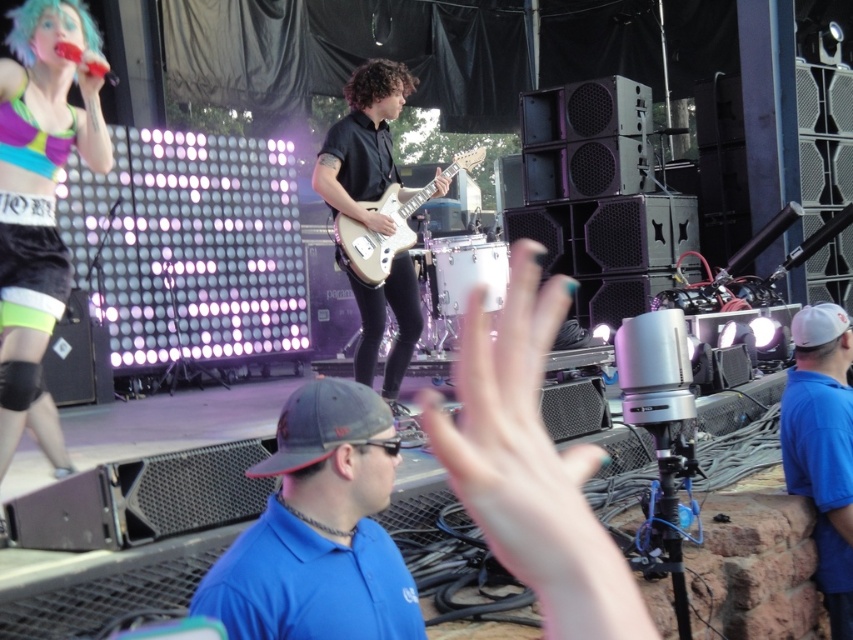
Is blue cotton shirt at right shorter than matte white guitar at center?

Yes, blue cotton shirt at right is shorter than matte white guitar at center.

Is point (821, 448) more distant than point (401, 97)?

No, (821, 448) is in front of (401, 97).

You are a GUI agent. You are given a task and a screenshot of the screen. Output one action in this format:
    pyautogui.click(x=<x>, y=<y>)
    Task: Click on the blue cotton shirt at right
    
    Given the screenshot: What is the action you would take?
    click(x=822, y=448)

Can you confirm if blue fabric shirt at center is thinner than blue cotton shirt at right?

In fact, blue fabric shirt at center might be wider than blue cotton shirt at right.

Is blue fabric shirt at center below blue cotton shirt at right?

Actually, blue fabric shirt at center is above blue cotton shirt at right.

Which is behind, point (316, 436) or point (799, 468)?

The point (799, 468) is behind.

The height and width of the screenshot is (640, 853). I want to click on blue fabric shirt at center, so click(x=318, y=529).

Is blue cotton shirt at right thinner than white glossy electric guitar at center?

Correct, blue cotton shirt at right's width is less than white glossy electric guitar at center's.

Does blue cotton shirt at right appear on the left side of white glossy electric guitar at center?

No, blue cotton shirt at right is not to the left of white glossy electric guitar at center.

What do you see at coordinates (822, 448) in the screenshot? I see `blue cotton shirt at right` at bounding box center [822, 448].

In order to click on blue cotton shirt at right in this screenshot , I will do (822, 448).